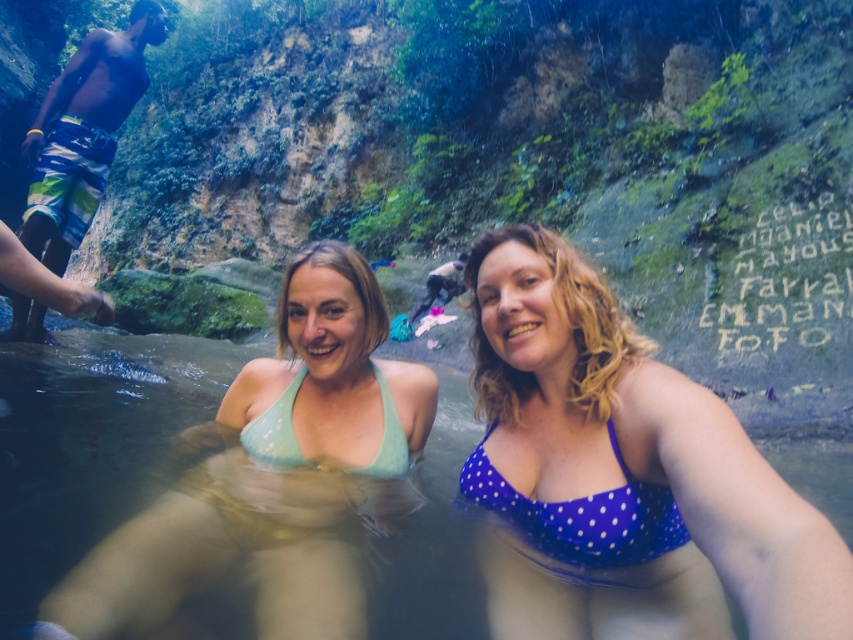
You are standing at the edge of the hot spring and see two women in bikinis. Which woman is wearing the matte green bikini top at center located to the left of the light blue polka dot bikini top at center?

The matte green bikini top at center is positioned on the left side of the light blue polka dot bikini top at center, so the woman wearing the matte green bikini top at center is to the left of the other woman.

Looking at this image, you are a photographer trying to capture a closeup of the light blue polka dot bikini top at center without including the multicolored striped shorts at left in the frame. Based on their positions, is this possible?

Yes, since the multicolored striped shorts at left are positioned to the left of the light blue polka dot bikini top at center, you can adjust the camera angle to exclude the shorts while focusing on the bikini top.